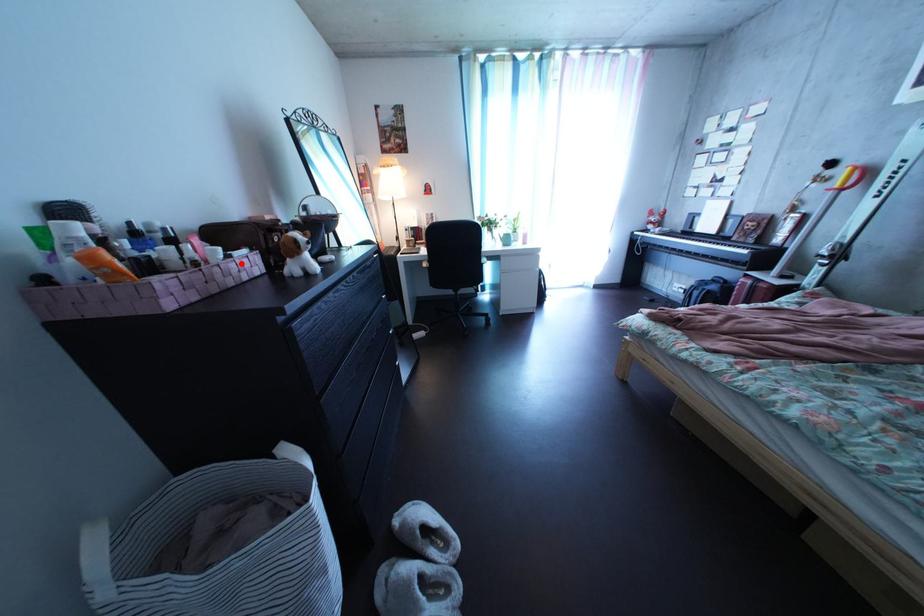
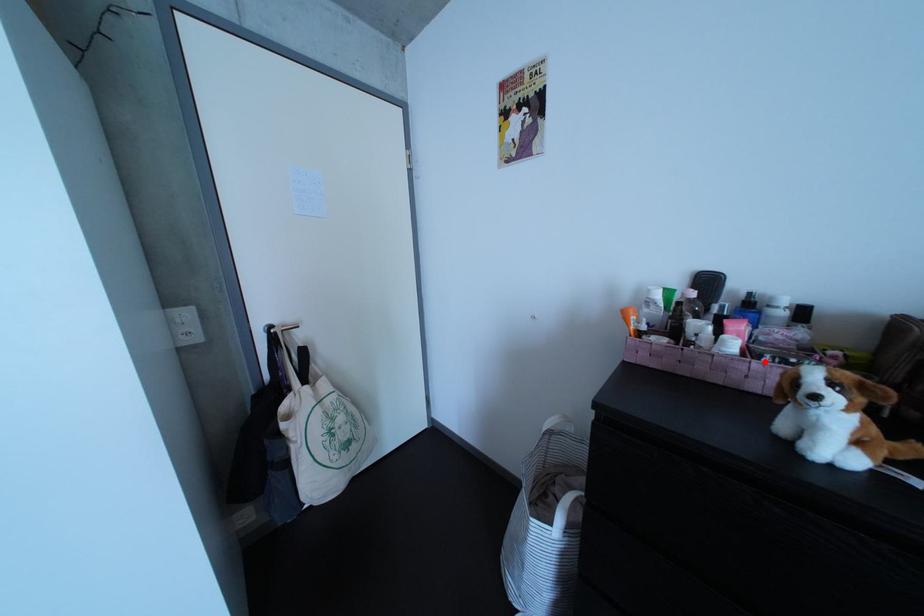
I am providing you with two images of the same scene from different viewpoints. A red point is marked on the first image and another point is marked on the second image. Is the red point in image1 aligned with the point shown in image2?

Yes